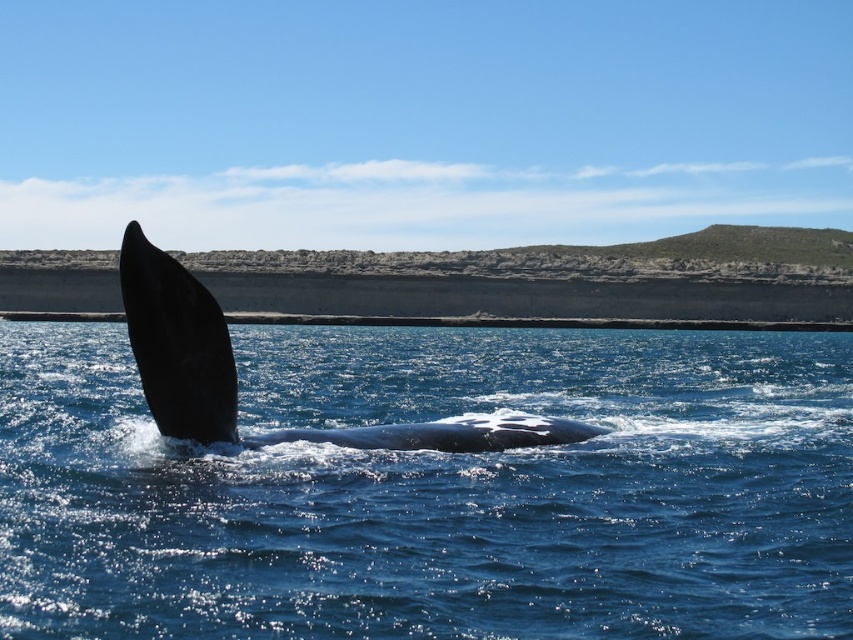
You are standing on a boat observing the blue water at center and the black smooth whale at left. Which object is nearer to you?

The blue water at center is closer to the viewer than the black smooth whale at left.

You are a marine biologist observing the coastal scene. You notice the blue water at center and the smooth dark gray whale at center. Based on their positions, which object is closer to you?

The blue water at center is closer to you because it is positioned in front of the smooth dark gray whale at center.

You are a drone operator trying to capture the whale breaching the surface. You need to position your drone at the point marked as point [433,490]. Based on the scene, what is the location of this point relative to the whale?

The point [433,490] is on blue water at center, which is where the whale is breaching. Therefore, the drone should position at the center of the water where the whale is actively surfacing.